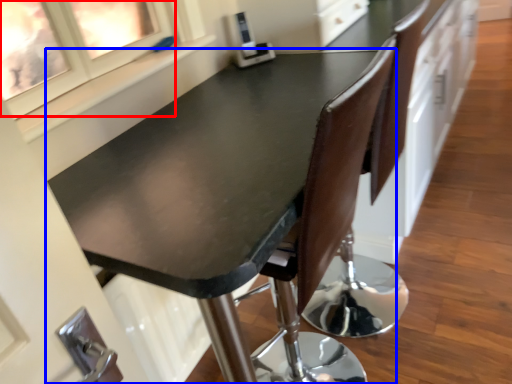
Question: Which object is closer to the camera taking this photo, window (highlighted by a red box) or table (highlighted by a blue box)?

Choices:
 (A) window
 (B) table

Answer: (B)